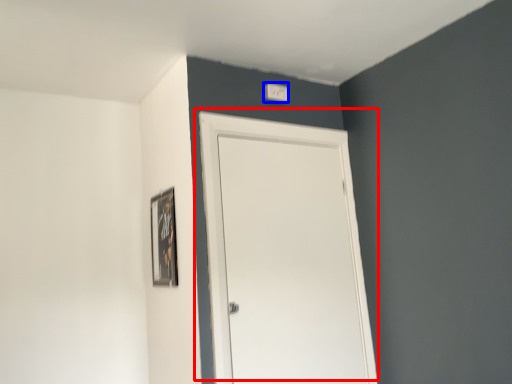
Question: Which object appears farthest to the camera in this image, door (highlighted by a red box) or light switch (highlighted by a blue box)?

Choices:
 (A) door
 (B) light switch

Answer: (B)